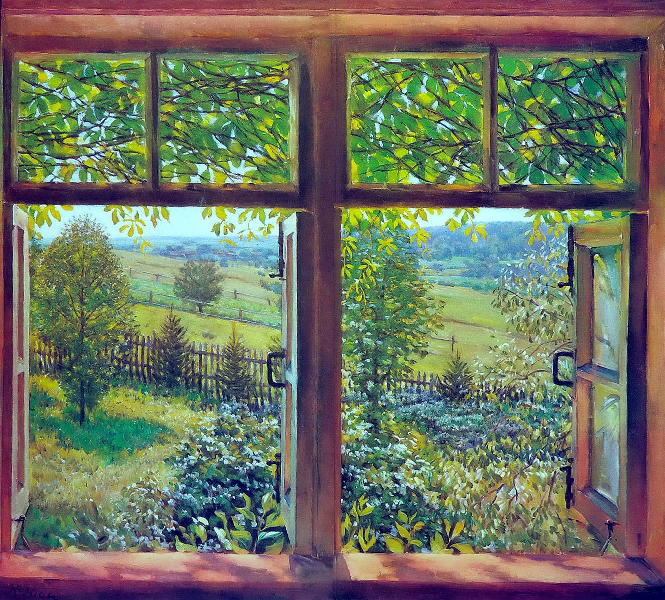
Identify the location of square window at top of image. (100, 127), (215, 127), (411, 142), (558, 136).